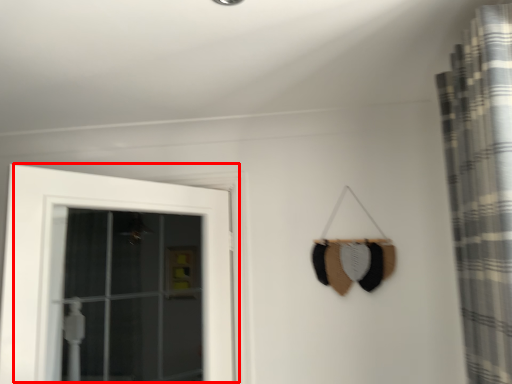
Question: In this image, where is door (annotated by the red box) located relative to curtain?

Choices:
 (A) left
 (B) right

Answer: (A)